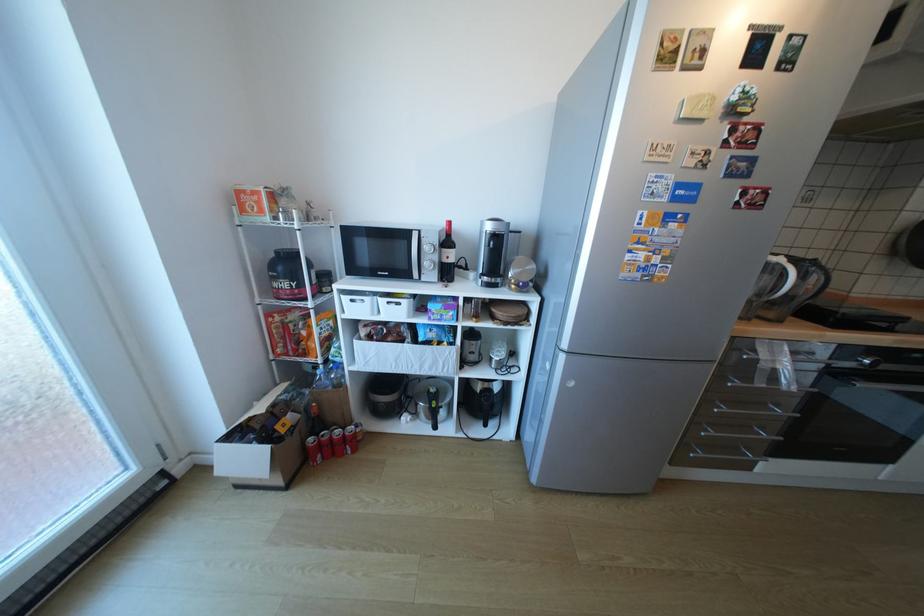
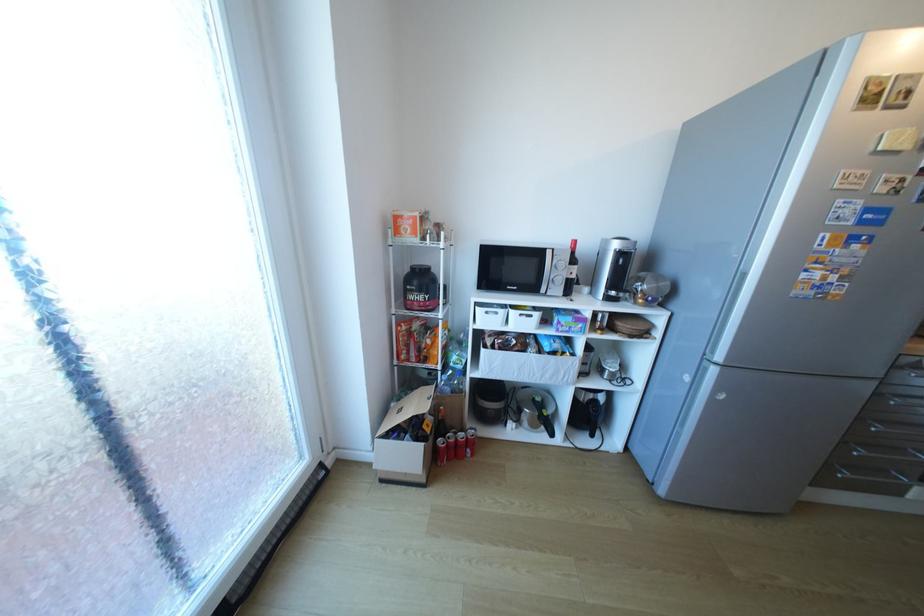
Where in the second image is the point corresponding to point 350,389 from the first image?

(472, 394)